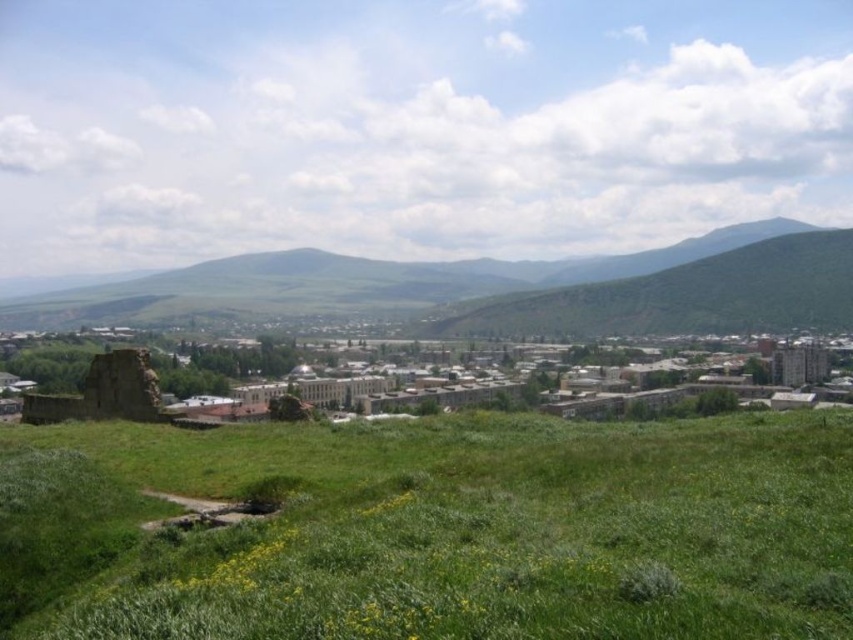
Question: Which point is closer to the camera?

Choices:
 (A) rusty stone ruin at lower left
 (B) green grassy field at lower center

Answer: (B)

Question: Does green grassy field at lower center appear on the left side of green grassy hill at center?

Choices:
 (A) no
 (B) yes

Answer: (A)

Question: Which point is farther to the camera?

Choices:
 (A) (840, 260)
 (B) (566, 499)
 (C) (103, 374)

Answer: (A)

Question: Considering the relative positions of green grassy field at lower center and green grassy hill at center in the image provided, where is green grassy field at lower center located with respect to green grassy hill at center?

Choices:
 (A) above
 (B) below

Answer: (B)

Question: Does green grassy hill at center appear over rusty stone ruin at lower left?

Choices:
 (A) no
 (B) yes

Answer: (B)

Question: Based on their relative distances, which object is farther from the green grassy field at lower center?

Choices:
 (A) green grassy hill at center
 (B) rusty stone ruin at lower left

Answer: (A)